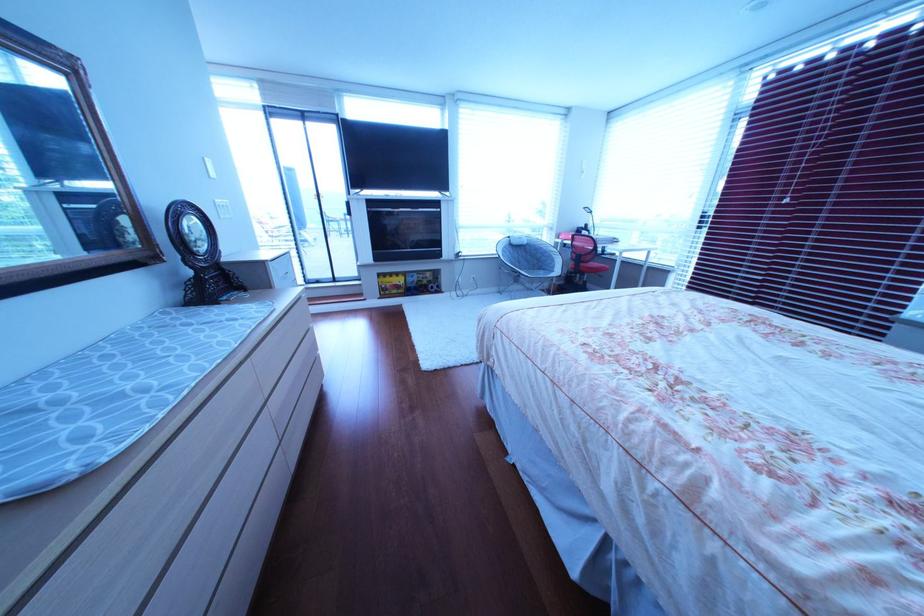
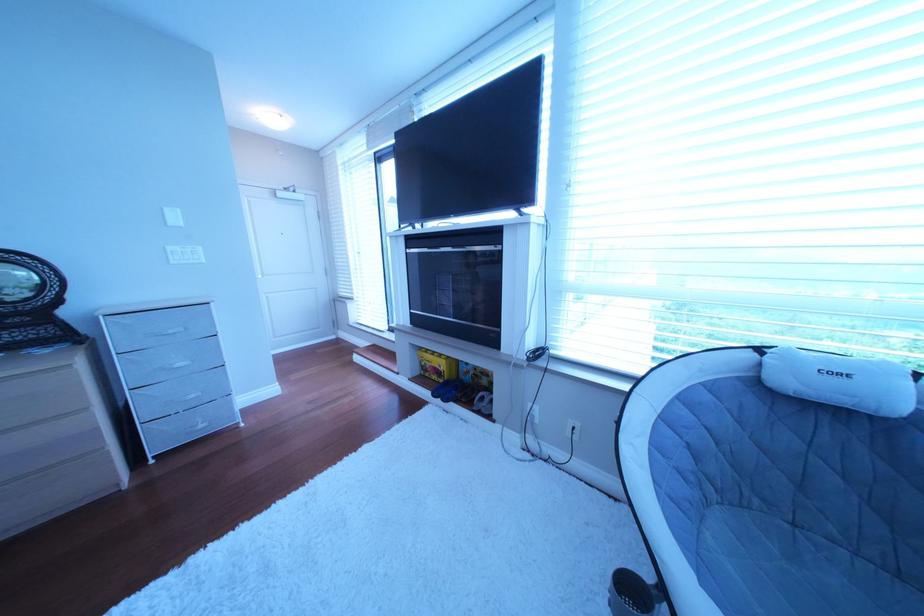
The point at (405, 286) is marked in the first image. Where is the corresponding point in the second image?

(444, 367)